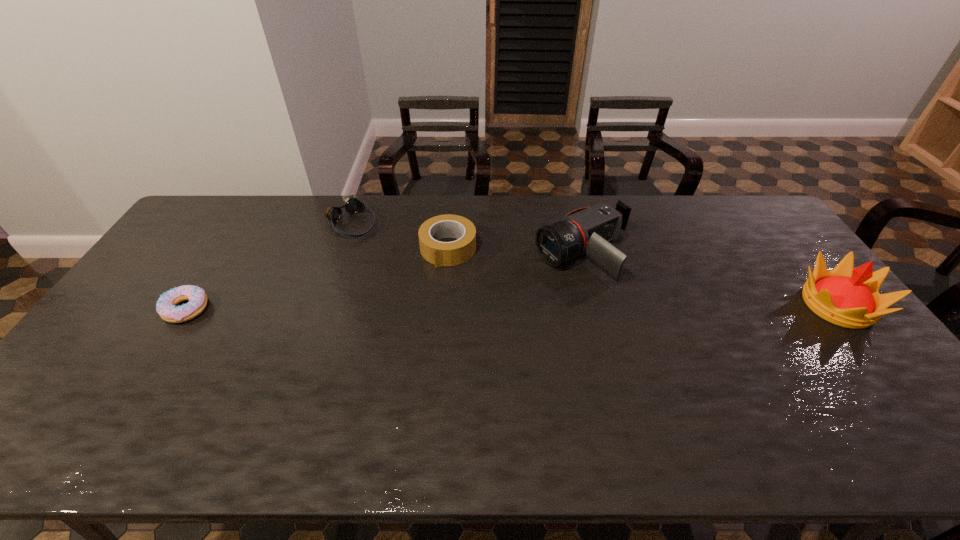
Find the location of `the shortest object`. the shortest object is located at coordinates (166, 307).

The height and width of the screenshot is (540, 960). Find the location of `the leftmost object`. the leftmost object is located at coordinates (166, 307).

You are a GUI agent. You are given a task and a screenshot of the screen. Output one action in this format:
    pyautogui.click(x=<x>, y=<y>)
    Task: Click on the crown
    The width and height of the screenshot is (960, 540).
    Given the screenshot: What is the action you would take?
    pyautogui.click(x=849, y=297)

The height and width of the screenshot is (540, 960). I want to click on the tallest object, so click(x=849, y=297).

Find the location of `camcorder`. camcorder is located at coordinates (588, 230).

This screenshot has width=960, height=540. In order to click on the second tallest object in this screenshot , I will do `click(588, 230)`.

Where is `duct tape`? duct tape is located at coordinates (439, 253).

In order to click on goggles in this screenshot , I will do `click(353, 206)`.

Where is `blank area located 0.390m on the right of the leftmost object`? blank area located 0.390m on the right of the leftmost object is located at coordinates (344, 309).

At what (x,y) coordinates should I click in order to perform the action: click on vacant space located 0.350m on the left of the tallest object. Please return your answer as a coordinate pair (x, y). The image size is (960, 540). Looking at the image, I should click on [x=678, y=305].